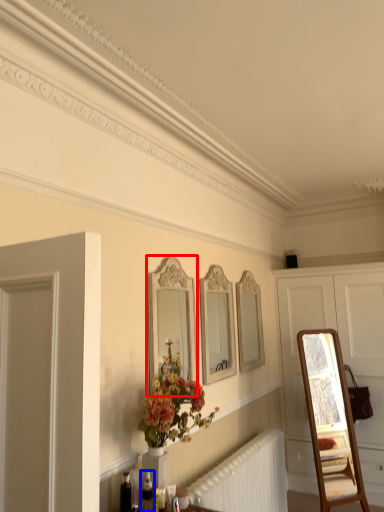
Question: Which point is further to the camera, mirror (highlighted by a red box) or toiletry (highlighted by a blue box)?

Choices:
 (A) mirror
 (B) toiletry

Answer: (A)